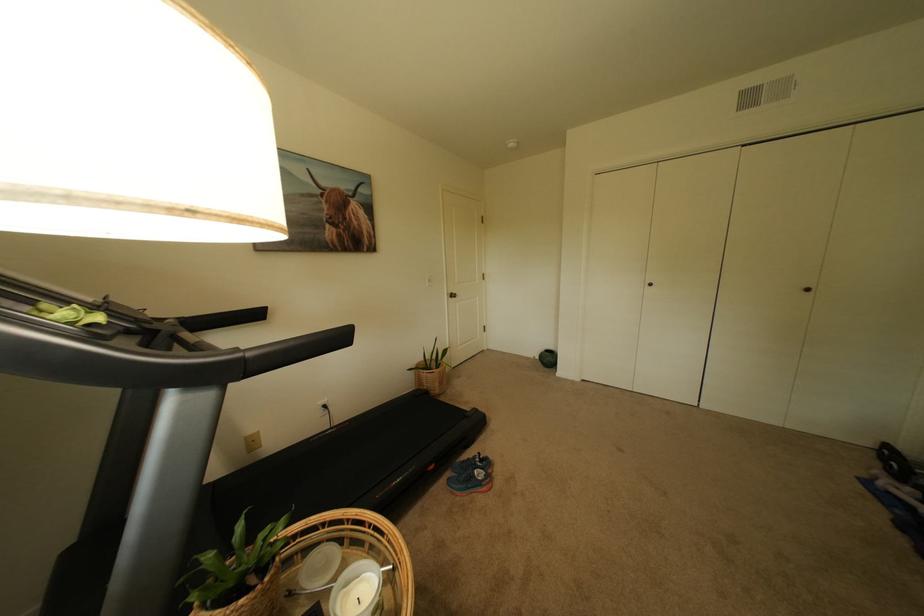
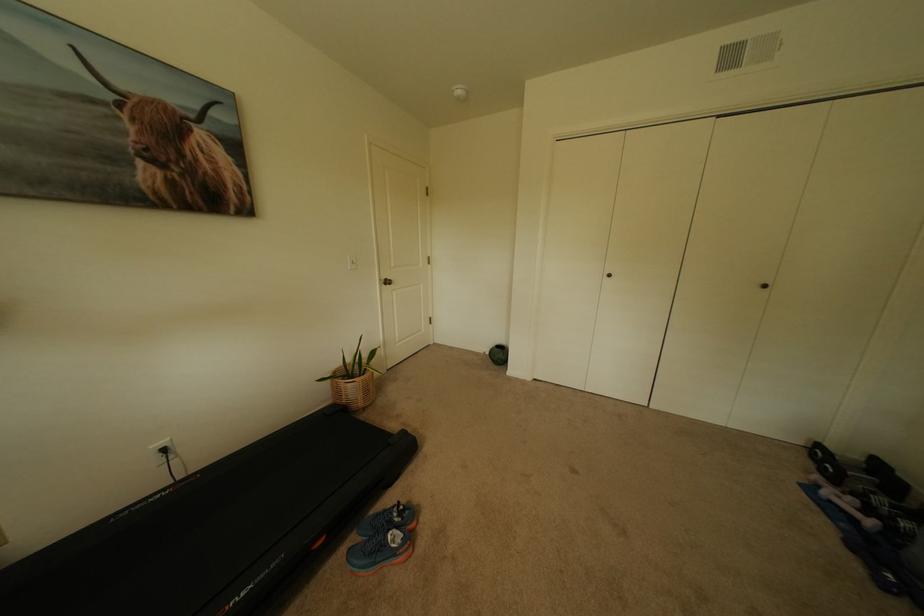
Locate, in the second image, the point that corresponds to the point at 541,358 in the first image.

(491, 353)